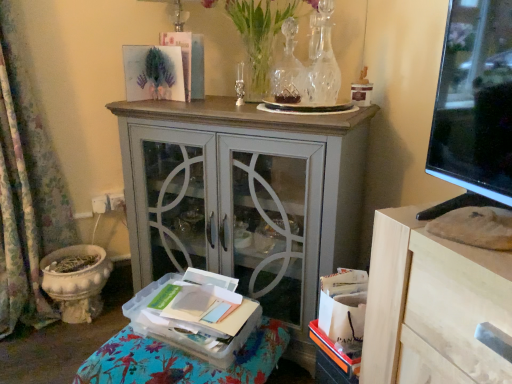
Image resolution: width=512 pixels, height=384 pixels. Find the location of `clear glass vase at upper center, the 1th vase positioned from the right`. clear glass vase at upper center, the 1th vase positioned from the right is located at coordinates (325, 61).

The image size is (512, 384). What are the coordinates of `clear glass vase at upper center` in the screenshot? It's located at (261, 34).

What do you see at coordinates (288, 70) in the screenshot? The width and height of the screenshot is (512, 384). I see `clear glass vase at upper center, acting as the 1th vase starting from the left` at bounding box center [288, 70].

Identify the location of floral fabric curtain at left. The height and width of the screenshot is (384, 512). click(x=26, y=189).

What is the approximate height of clear plastic tray at lower left?

It is 8.66 inches.

Locate an element on the screen. The width and height of the screenshot is (512, 384). clear glass vase at upper center, the second vase when ordered from left to right is located at coordinates (325, 61).

Measure the distance between clear glass vase at upper center and clear glass vase at upper center, the 1th vase positioned from the right.

The distance of clear glass vase at upper center from clear glass vase at upper center, the 1th vase positioned from the right, is 11.94 inches.

From the picture: Are clear glass vase at upper center and clear glass vase at upper center, the 1th vase positioned from the right, far apart?

No.

Is clear glass vase at upper center located outside clear glass vase at upper center, the second vase when ordered from left to right?

Yes.

You are a GUI agent. You are given a task and a screenshot of the screen. Output one action in this format:
    pyautogui.click(x=<x>, y=<y>)
    Task: Click on the 2nd vase behind the clear glass vase at upper center
    The image size is (512, 384).
    Given the screenshot: What is the action you would take?
    pyautogui.click(x=325, y=61)

In terms of size, does clear glass vase at upper center appear bigger or smaller than floral fabric curtain at left?

Clearly, clear glass vase at upper center is smaller in size than floral fabric curtain at left.

Is point (263, 0) positioned in front of point (16, 260)?

Yes.

From a real-world perspective, who is located lower, clear glass vase at upper center or floral fabric curtain at left?

From a 3D spatial view, floral fabric curtain at left is below.

Is clear glass vase at upper center inside or outside of floral fabric curtain at left?

The correct answer is: outside.

From a real-world perspective, is clear glass vase at upper center, the second vase when ordered from left to right, over clear glass vase at upper center?

No.

Is clear glass vase at upper center, the 1th vase positioned from the right, further to camera compared to clear glass vase at upper center?

That is True.

Is clear glass vase at upper center at the back of clear glass vase at upper center, the 1th vase positioned from the right?

Yes, clear glass vase at upper center is at the back of clear glass vase at upper center, the 1th vase positioned from the right.

Looking at the image, does clear glass vase at upper center, the second vase when ordered from left to right, seem bigger or smaller compared to clear glass vase at upper center?

Considering their sizes, clear glass vase at upper center, the second vase when ordered from left to right, takes up less space than clear glass vase at upper center.

Find the location of `cabinetry on the right of the floral fabric curtain at left`. cabinetry on the right of the floral fabric curtain at left is located at coordinates (245, 198).

Is gray painted cabinet at center wider than floral fabric curtain at left?

Correct, the width of gray painted cabinet at center exceeds that of floral fabric curtain at left.

Which of these two, gray painted cabinet at center or floral fabric curtain at left, is bigger?

gray painted cabinet at center.

Which is closer to the camera, [31,250] or [328,79]?

Point [31,250] is positioned farther from the camera compared to point [328,79].

In the scene shown: Can you confirm if floral fabric curtain at left is shorter than clear glass vase at upper center, the 1th vase positioned from the right?

No.

From the image's perspective, between floral fabric curtain at left and clear glass vase at upper center, the second vase when ordered from left to right, who is located below?

From the image's view, floral fabric curtain at left is below.

Considering the positions of objects floral fabric curtain at left and clear glass vase at upper center, the second vase when ordered from left to right, in the image provided, who is more to the left, floral fabric curtain at left or clear glass vase at upper center, the second vase when ordered from left to right,?

From the viewer's perspective, floral fabric curtain at left appears more on the left side.

Can you tell me how much clear glass vase at upper center, which ranks as the 2th vase in right-to-left order, and floral fabric curtain at left differ in facing direction?

The facing directions of clear glass vase at upper center, which ranks as the 2th vase in right-to-left order, and floral fabric curtain at left are 49 degrees apart.

At what (x,y) coordinates should I click in order to perform the action: click on curtain located in front of the clear glass vase at upper center, acting as the 1th vase starting from the left. Please return your answer as a coordinate pair (x, y). This screenshot has height=384, width=512. Looking at the image, I should click on (26, 189).

Is there a large distance between clear glass vase at upper center, acting as the 1th vase starting from the left, and floral fabric curtain at left?

Yes, clear glass vase at upper center, acting as the 1th vase starting from the left, and floral fabric curtain at left are located far from each other.

Could floral fabric curtain at left be considered to be inside clear glass vase at upper center, acting as the 1th vase starting from the left?

No, floral fabric curtain at left is not surrounded by clear glass vase at upper center, acting as the 1th vase starting from the left.

Is floral fabric curtain at left thinner than clear glass vase at upper center?

Indeed, floral fabric curtain at left has a lesser width compared to clear glass vase at upper center.

From the image's perspective, relative to clear glass vase at upper center, is floral fabric curtain at left above or below?

floral fabric curtain at left is below clear glass vase at upper center.

How much distance is there between floral fabric curtain at left and clear glass vase at upper center?

floral fabric curtain at left and clear glass vase at upper center are 37.08 inches apart from each other.

Who is smaller, floral fabric curtain at left or clear glass vase at upper center?

clear glass vase at upper center is smaller.

From the image's perspective, starting from the clear glass vase at upper center, which vase is the 1st one below? Please provide its 2D coordinates.

[(325, 61)]

Locate an element on the screen. floral arrangement to the right of floral fabric curtain at left is located at coordinates [x=261, y=34].

Considering their positions, is clear glass vase at upper center, acting as the 1th vase starting from the left, positioned closer to floral fabric curtain at left than gray painted cabinet at center?

Based on the image, gray painted cabinet at center appears to be nearer to floral fabric curtain at left.

From the picture: From the image, which object appears to be nearer to clear glass vase at upper center, which ranks as the 2th vase in right-to-left order, clear plastic tray at lower left or floral fabric curtain at left?

clear plastic tray at lower left.

When comparing their distances from clear glass vase at upper center, does clear glass vase at upper center, which ranks as the 2th vase in right-to-left order, or clear glass vase at upper center, the 1th vase positioned from the right, seem closer?

clear glass vase at upper center, which ranks as the 2th vase in right-to-left order, lies closer to clear glass vase at upper center than the other object.

Looking at the image, which one is located further to clear glass vase at upper center, the second vase when ordered from left to right, clear glass vase at upper center or clear plastic tray at lower left?

clear plastic tray at lower left is positioned further to the anchor clear glass vase at upper center, the second vase when ordered from left to right.

Looking at the image, which one is located closer to clear glass vase at upper center, the 1th vase positioned from the right, clear glass vase at upper center, which ranks as the 2th vase in right-to-left order, or clear plastic tray at lower left?

clear glass vase at upper center, which ranks as the 2th vase in right-to-left order, is positioned closer to the anchor clear glass vase at upper center, the 1th vase positioned from the right.

Estimate the real-world distances between objects in this image. Which object is closer to clear glass vase at upper center, gray painted cabinet at center or clear glass vase at upper center, acting as the 1th vase starting from the left?

The object closer to clear glass vase at upper center is clear glass vase at upper center, acting as the 1th vase starting from the left.

Considering their positions, is clear glass vase at upper center, acting as the 1th vase starting from the left, positioned closer to clear plastic tray at lower left than clear glass vase at upper center, the second vase when ordered from left to right?

clear glass vase at upper center, acting as the 1th vase starting from the left, lies closer to clear plastic tray at lower left than the other object.

When comparing their distances from clear glass vase at upper center, does clear plastic tray at lower left or clear glass vase at upper center, acting as the 1th vase starting from the left, seem further?

Based on the image, clear plastic tray at lower left appears to be further to clear glass vase at upper center.

Locate an element on the screen. vase between clear glass vase at upper center, the second vase when ordered from left to right, and gray painted cabinet at center vertically is located at coordinates (288, 70).

Locate an element on the screen. The image size is (512, 384). floral arrangement located between floral fabric curtain at left and clear glass vase at upper center, the 1th vase positioned from the right, in the left-right direction is located at coordinates pos(261,34).

The image size is (512, 384). What are the coordinates of `vase between clear glass vase at upper center and clear glass vase at upper center, the second vase when ordered from left to right, from left to right` in the screenshot? It's located at (288, 70).

At what (x,y) coordinates should I click in order to perform the action: click on cabinetry situated between floral fabric curtain at left and clear glass vase at upper center, the second vase when ordered from left to right, from left to right. Please return your answer as a coordinate pair (x, y). Image resolution: width=512 pixels, height=384 pixels. Looking at the image, I should click on pyautogui.click(x=245, y=198).